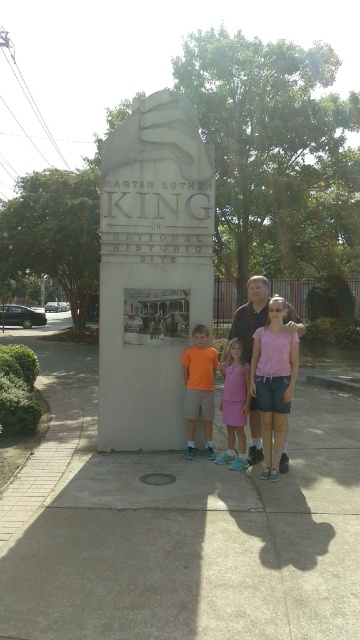
You are a photographer trying to capture the family standing in front of the monument. You want to ensure the concrete at center and the matte black shirt at center are both visible in the photo. Based on their positions, which object should appear closer to the camera?

The concrete at center is in front of the matte black shirt at center, so the concrete at center will appear closer to the camera in the photo.

You are a photographer taking a picture of the monument. You notice the orange cotton shirt at lower center and the pink fabric dress at center. Which of these two items is closer to the camera?

The orange cotton shirt at lower center is closer to the camera because the pink fabric dress at center is behind it.

You are a photographer taking a group photo of the family in front of the Martin Luther King Jr. monument. You notice two shirts in the scene, a matte black shirt at center and an orange cotton shirt at lower center. Which shirt appears bigger in the photo?

The matte black shirt at center appears bigger in the photo because it has a larger size compared to the orange cotton shirt at lower center.